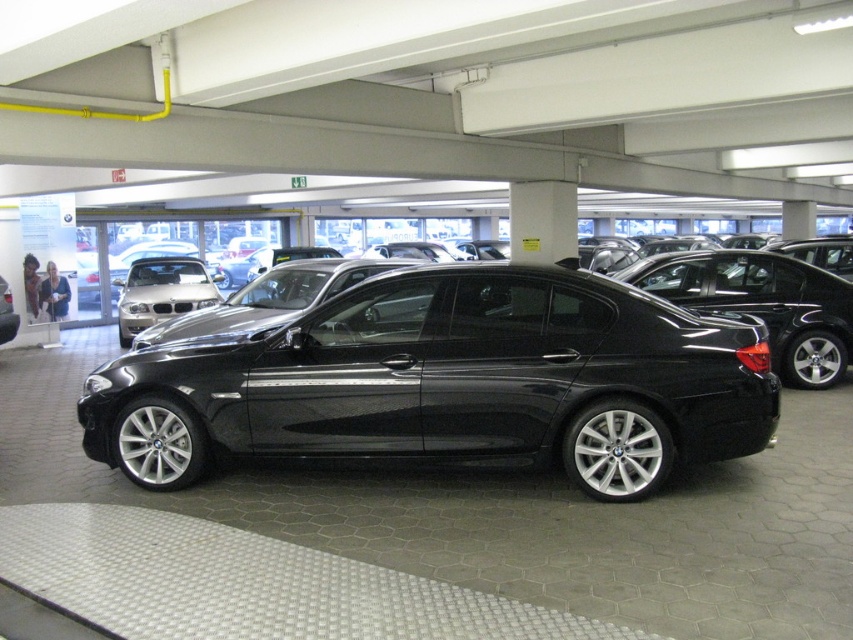
Between glossy black sedan at center and satin silver sedan at center, which one is positioned higher?

satin silver sedan at center is higher up.

Does glossy black sedan at center have a greater width compared to satin silver sedan at center?

Correct, the width of glossy black sedan at center exceeds that of satin silver sedan at center.

Where is `glossy black sedan at center`? glossy black sedan at center is located at coordinates (451, 381).